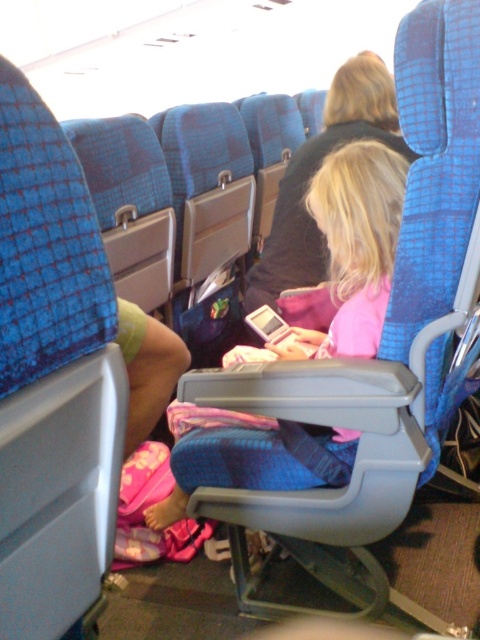
Question: Which point is farther to the camera?

Choices:
 (A) dark blue fabric jacket at center
 (B) pink fabric at center

Answer: (A)

Question: Which object is closer to the camera taking this photo?

Choices:
 (A) pink fabric at center
 (B) dark blue fabric jacket at center

Answer: (A)

Question: Can you confirm if pink fabric at center is bigger than dark blue fabric jacket at center?

Choices:
 (A) no
 (B) yes

Answer: (B)

Question: Which of the following is the closest to the observer?

Choices:
 (A) pink fabric at center
 (B) dark blue fabric jacket at center

Answer: (A)

Question: In this image, where is pink fabric at center located relative to dark blue fabric jacket at center?

Choices:
 (A) above
 (B) below

Answer: (B)

Question: Is pink fabric at center thinner than dark blue fabric jacket at center?

Choices:
 (A) yes
 (B) no

Answer: (B)